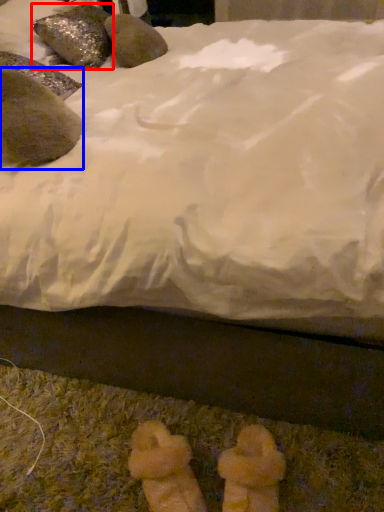
Question: Which object appears farthest to the camera in this image, animal (highlighted by a red box) or animal (highlighted by a blue box)?

Choices:
 (A) animal
 (B) animal

Answer: (A)